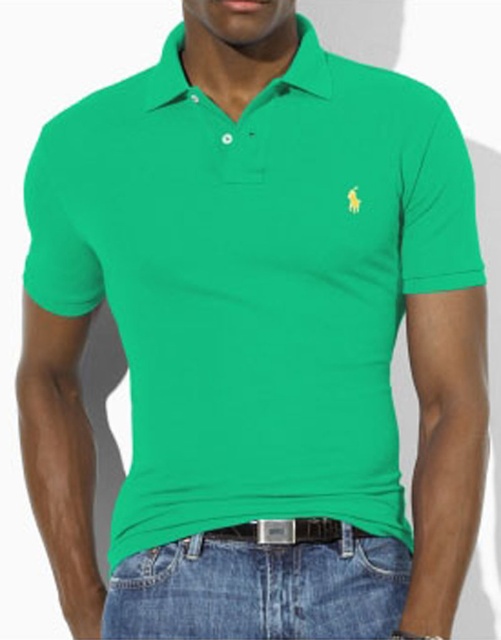
You are trying to place a wallet in the correct location on the person wearing the bright green polo shirt. According to the image, where should the wallet be placed relative to the denim jeans at lower center and the jeans pocket at lower center?

The wallet should be placed in the jeans pocket at lower center, which is above the denim jeans at lower center.